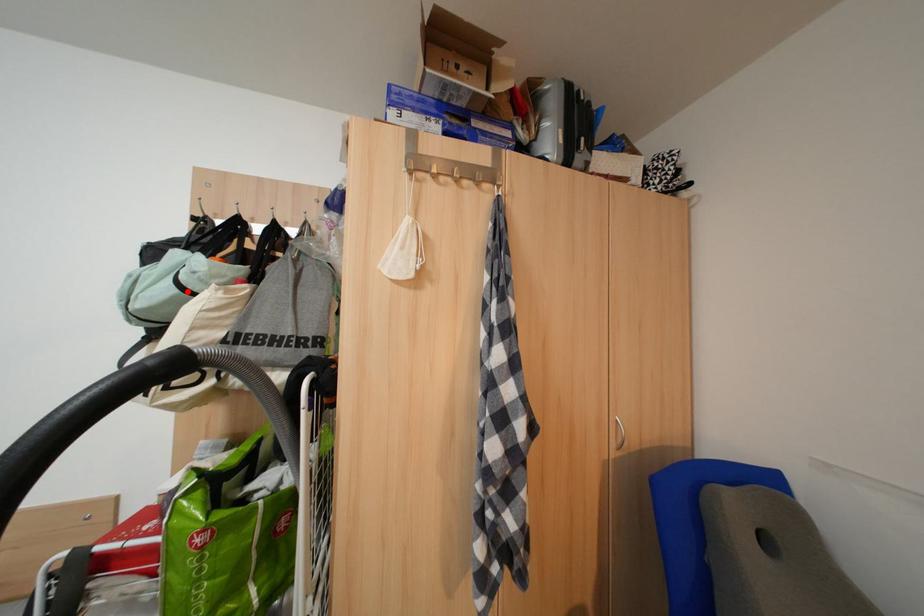
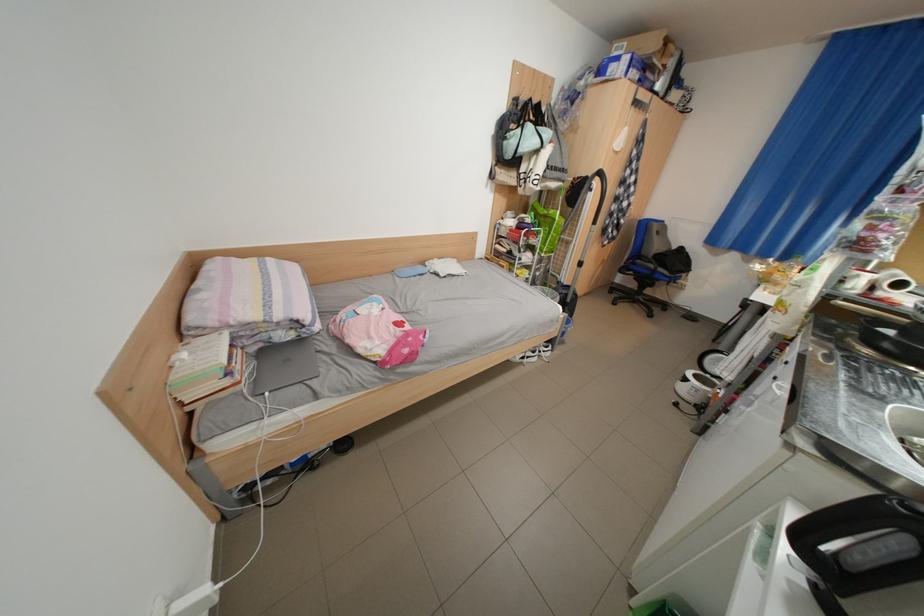
In the second image, find the point that corresponds to the highlighted location in the first image.

(552, 147)